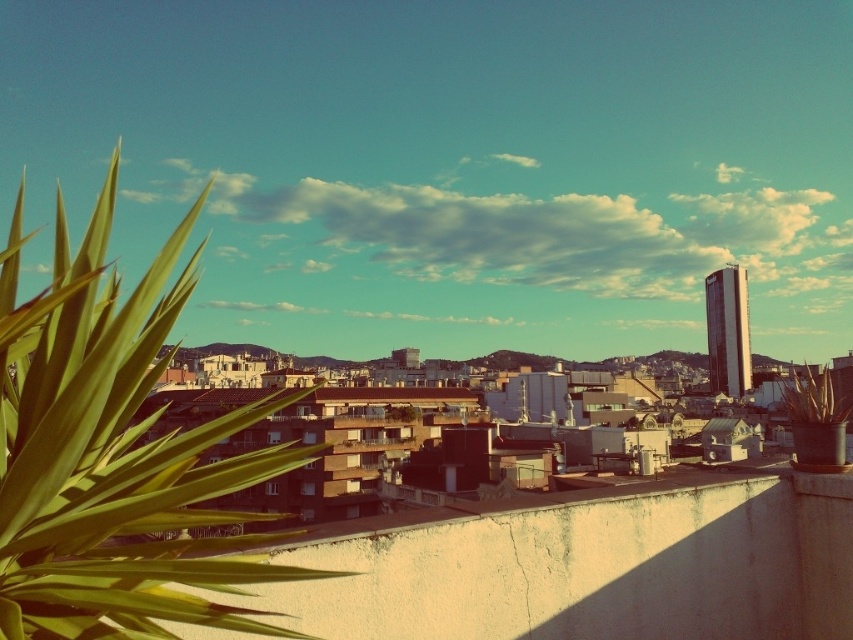
Question: Which point is closer to the camera?

Choices:
 (A) green leafy plant at upper left
 (B) green leafy plant at left

Answer: (B)

Question: Which object is closer to the camera taking this photo?

Choices:
 (A) green leafy plant at upper left
 (B) green leafy plant at left

Answer: (B)

Question: Is green leafy plant at left wider than green leafy plant at upper left?

Choices:
 (A) no
 (B) yes

Answer: (B)

Question: Is green leafy plant at left wider than green leafy plant at upper left?

Choices:
 (A) yes
 (B) no

Answer: (A)

Question: Among these points, which one is farthest from the camera?

Choices:
 (A) (117, 333)
 (B) (788, 396)

Answer: (B)

Question: Considering the relative positions of green leafy plant at left and green leafy plant at upper left in the image provided, where is green leafy plant at left located with respect to green leafy plant at upper left?

Choices:
 (A) right
 (B) left

Answer: (B)